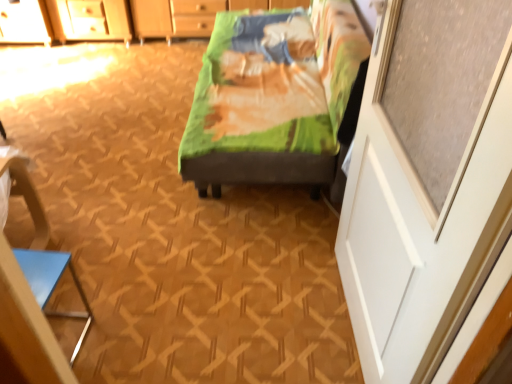
The width and height of the screenshot is (512, 384). I want to click on vacant space that is to the left of white matte screen door at right, so click(x=251, y=316).